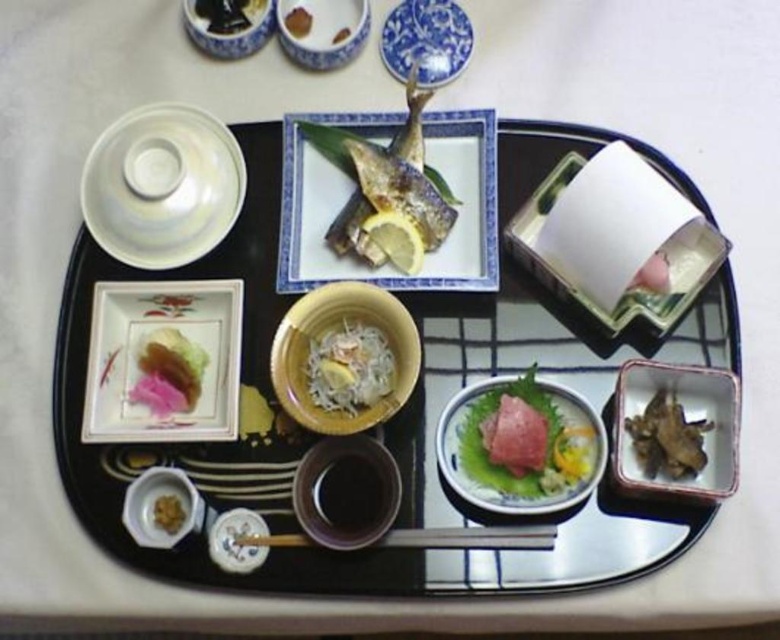
Question: Which point appears closest to the camera in this image?

Choices:
 (A) (162, 209)
 (B) (243, 0)
 (C) (406, 544)

Answer: (C)

Question: Does matte ceramic dish at lower left appear on the right side of black glossy soy sauce at upper left?

Choices:
 (A) no
 (B) yes

Answer: (A)

Question: Is porcelain plate with fish at center further to the viewer compared to pink translucent jelly at center left?

Choices:
 (A) no
 (B) yes

Answer: (A)

Question: Can you confirm if yellow matte bowl at center is positioned above wooden chopsticks at lower center?

Choices:
 (A) no
 (B) yes

Answer: (B)

Question: Which object is the farthest from the golden glazed fish at upper center?

Choices:
 (A) dark brown wooden bowl at lower right
 (B) smooth brown rice at center

Answer: (A)

Question: Which of the following is the farthest from the observer?

Choices:
 (A) blue porcelain plate at upper center
 (B) smooth brown rice at center
 (C) matte ceramic dish at lower left

Answer: (B)